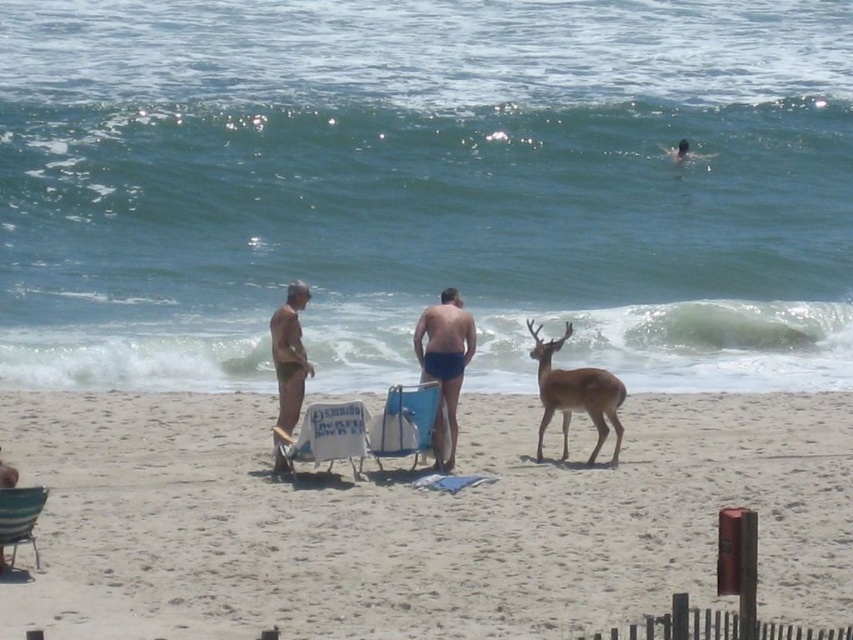
Question: Does brown velvet deer at center appear over metallic silver beach chair at lower left?

Choices:
 (A) yes
 (B) no

Answer: (A)

Question: Estimate the real-world distances between objects in this image. Which object is farther from the brown velvet deer at center?

Choices:
 (A) blue fabric beach chair at center
 (B) white fabric beach chair at center
 (C) matte blue shorts at center
 (D) beige sand at center

Answer: (B)

Question: Which point is closer to the camera taking this photo?

Choices:
 (A) (22, 516)
 (B) (294, 355)
 (C) (762, 492)

Answer: (A)

Question: Which object is positioned closest to the matte skin man at center?

Choices:
 (A) white fabric beach chair at center
 (B) beige sand at center
 (C) brown velvet deer at center

Answer: (A)

Question: Is beige sand at center to the right of white fabric beach chair at center from the viewer's perspective?

Choices:
 (A) yes
 (B) no

Answer: (A)

Question: Does brown velvet deer at center have a lesser width compared to metallic silver beach chair at lower left?

Choices:
 (A) no
 (B) yes

Answer: (A)